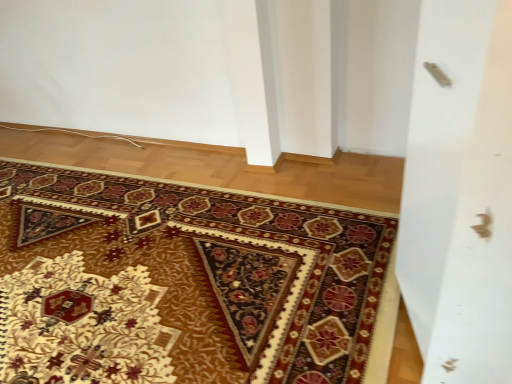
Question: Does point (366, 264) appear closer or farther from the camera than point (455, 182)?

Choices:
 (A) closer
 (B) farther

Answer: (B)

Question: From the image's perspective, relative to silver metallic screen door at upper right, is carpet with intricate patterns at center above or below?

Choices:
 (A) above
 (B) below

Answer: (B)

Question: From a real-world perspective, is carpet with intricate patterns at center positioned above or below silver metallic screen door at upper right?

Choices:
 (A) above
 (B) below

Answer: (B)

Question: Does point (426, 251) appear closer or farther from the camera than point (308, 266)?

Choices:
 (A) closer
 (B) farther

Answer: (A)

Question: Considering their positions, is silver metallic screen door at upper right located in front of or behind carpet with intricate patterns at center?

Choices:
 (A) behind
 (B) front

Answer: (B)

Question: Is silver metallic screen door at upper right wider or thinner than carpet with intricate patterns at center?

Choices:
 (A) thin
 (B) wide

Answer: (A)

Question: Is silver metallic screen door at upper right spatially inside carpet with intricate patterns at center, or outside of it?

Choices:
 (A) outside
 (B) inside

Answer: (A)